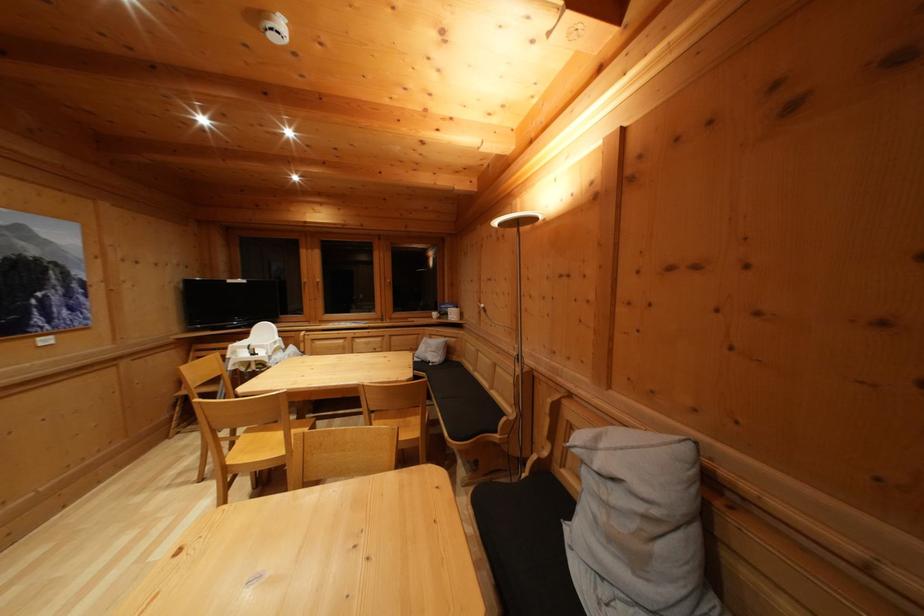
This screenshot has width=924, height=616. Describe the element at coordinates (254, 346) in the screenshot. I see `a white high chair sitting surface` at that location.